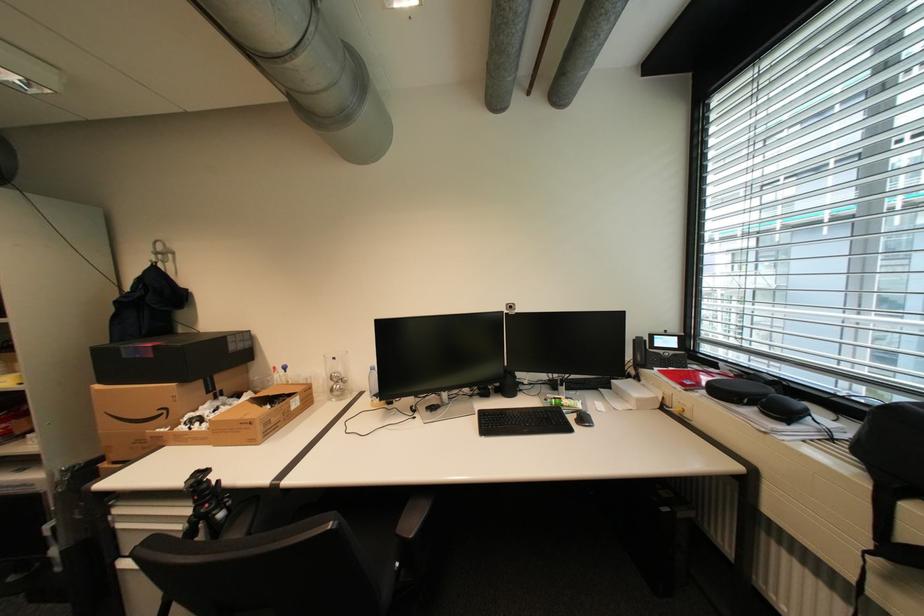
Locate an element on the screen. This screenshot has height=616, width=924. phone handset is located at coordinates (659, 351).